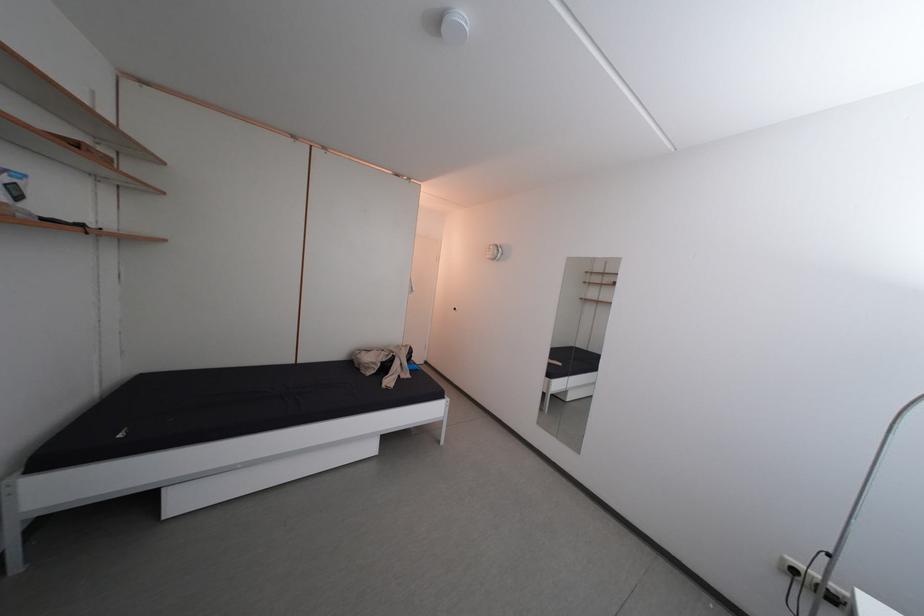
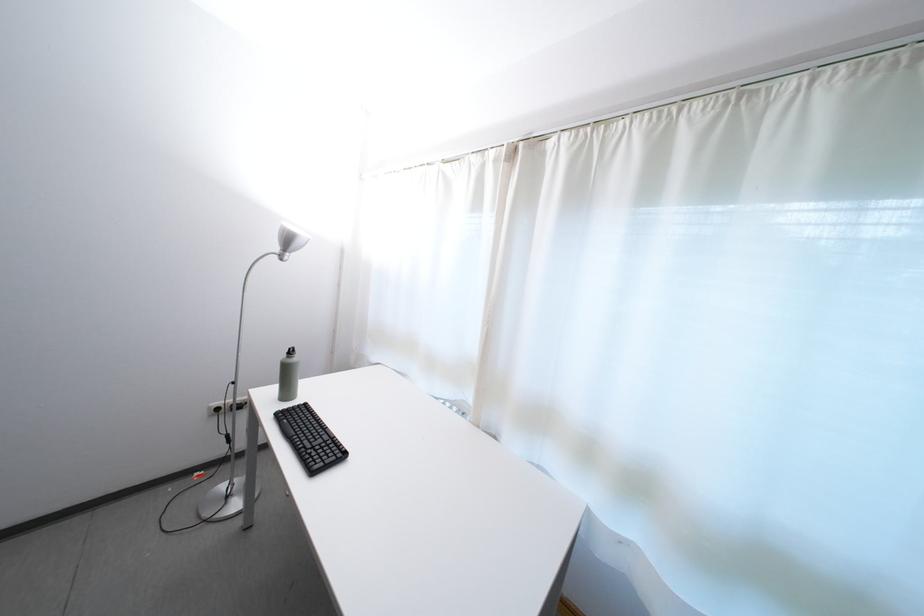
Locate, in the second image, the point that corresponds to point 793,565 in the first image.

(219, 413)